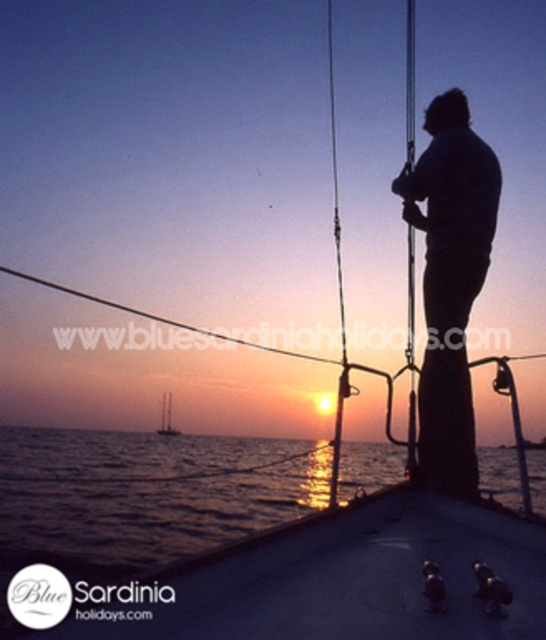
Measure the distance between black matte figure at center and white matte sailboat at center.

The distance of black matte figure at center from white matte sailboat at center is 238.06 meters.

Who is positioned more to the right, black matte figure at center or white matte sailboat at center?

Positioned to the right is black matte figure at center.

Which is behind, point (440, 163) or point (168, 426)?

The point (168, 426) is more distant.

Locate an element on the screen. This screenshot has height=640, width=546. black matte figure at center is located at coordinates (449, 282).

Locate an element on the screen. The width and height of the screenshot is (546, 640). smooth water at lower center is located at coordinates (275, 563).

Between point (275, 532) and point (170, 419), which one is positioned in front?

Positioned in front is point (275, 532).

Does point (422, 496) come closer to viewer compared to point (161, 422)?

Yes.

In order to click on smooth water at lower center in this screenshot , I will do `click(275, 563)`.

Based on the photo, between smooth water at lower center and black matte figure at center, which one is positioned higher?

Positioned higher is black matte figure at center.

Is smooth water at lower center positioned before black matte figure at center?

Yes, it is.

Which is behind, point (480, 509) or point (467, 445)?

Point (467, 445)

Identify the location of smooth water at lower center. This screenshot has width=546, height=640. (275, 563).